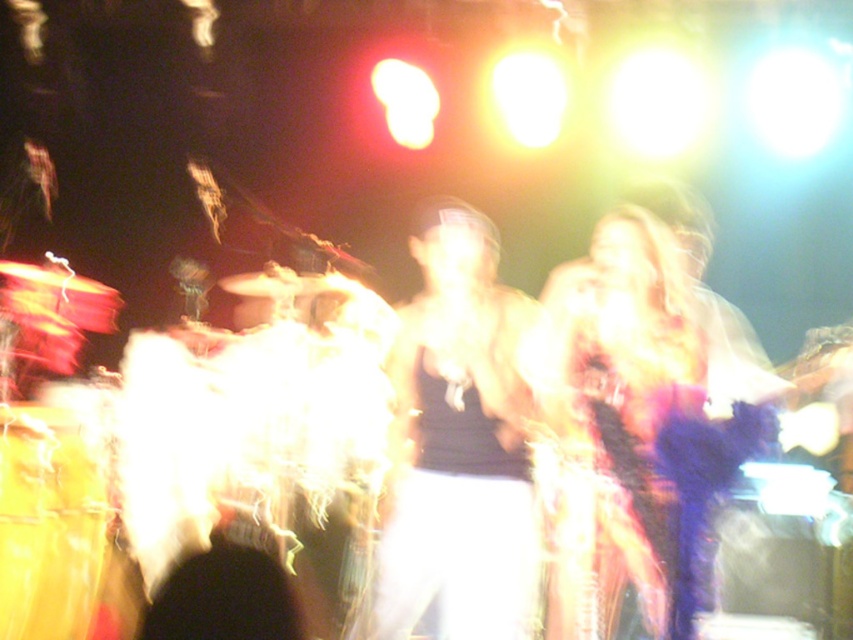
Based on the scene description, can you determine if the shiny purple dress at center is wider than the shiny gold drum at lower left?

The shiny purple dress at center is wider than the shiny gold drum at lower left according to the description.

You are standing in the middle of the concert venue and see two points marked in the image. The first point is at coordinate point(x=595, y=298) and the second point is at point(x=51, y=416). Which point is closer to you?

Point(x=595, y=298) is in front of point(x=51, y=416), so it is closer to you.

You are at a concert and want to take a clear photo of the performer closest to the camera. The camera can focus on objects within 10 feet. Is the point at coordinates point [689,348] within the focus range?

The point [689,348] is 9.59 feet away from the camera, so yes, it is within the focus range of 10 feet.